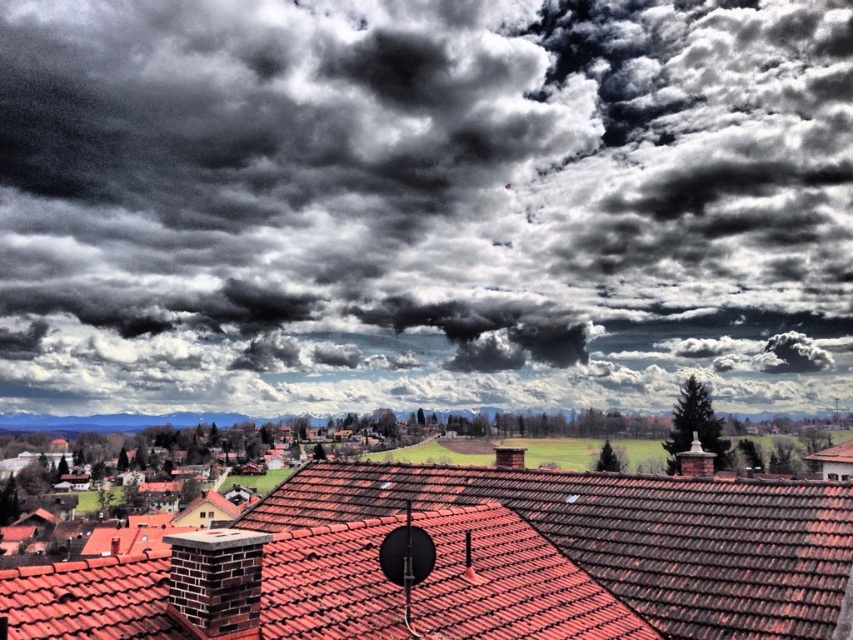
Between point (256, 292) and point (105, 573), which one is positioned behind?

The point (256, 292) is behind.

At what (x,y) coordinates should I click in order to perform the action: click on dark gray cloud at upper center. Please return your answer as a coordinate pair (x, y). This screenshot has width=853, height=640. Looking at the image, I should click on (422, 204).